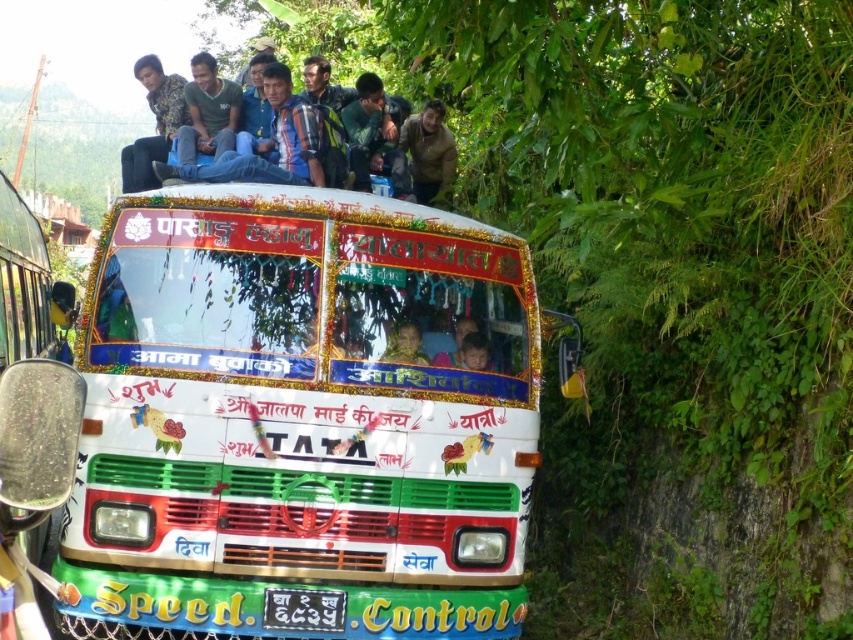
Question: Is blue denim jeans at upper center wider than brown matte jacket at upper center?

Choices:
 (A) yes
 (B) no

Answer: (A)

Question: Can you confirm if matte blue jeans at upper center is positioned to the right of brown matte jacket at upper center?

Choices:
 (A) no
 (B) yes

Answer: (A)

Question: Which of the following is the closest to the observer?

Choices:
 (A) golden fabric headscarf at center
 (B) blue denim jeans at upper center
 (C) brown matte jacket at upper center

Answer: (A)

Question: Among these objects, which one is farthest from the camera?

Choices:
 (A) matte blue jeans at upper center
 (B) golden fabric headscarf at center
 (C) brown matte jacket at upper center

Answer: (A)

Question: Which point is closer to the camera?

Choices:
 (A) (132, 161)
 (B) (427, 100)
 (C) (366, 154)

Answer: (A)

Question: Can you confirm if white glossy bus at center is smaller than golden fabric headscarf at center?

Choices:
 (A) no
 (B) yes

Answer: (A)